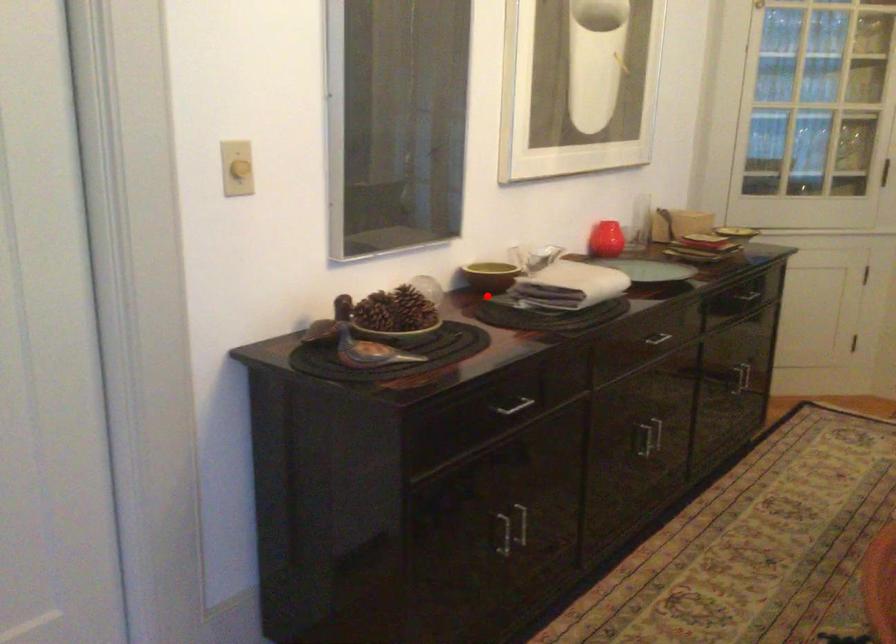
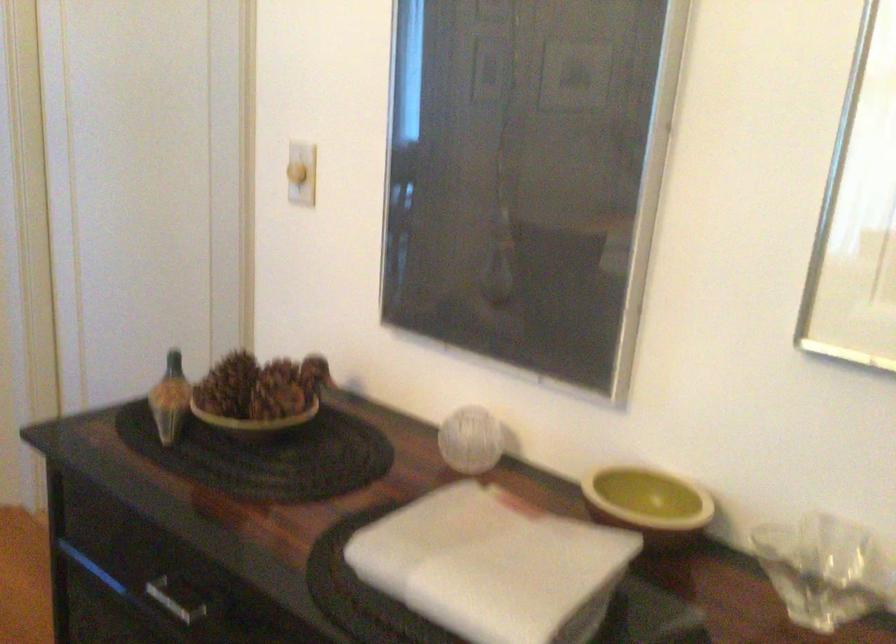
Question: I am providing you with two images of the same scene from different viewpoints. Image1 has a red point marked. In image2, the corresponding 3D location appears at what relative position? Reply with the corresponding letter.

Choices:
 (A) Closer
 (B) Farther

Answer: (A)